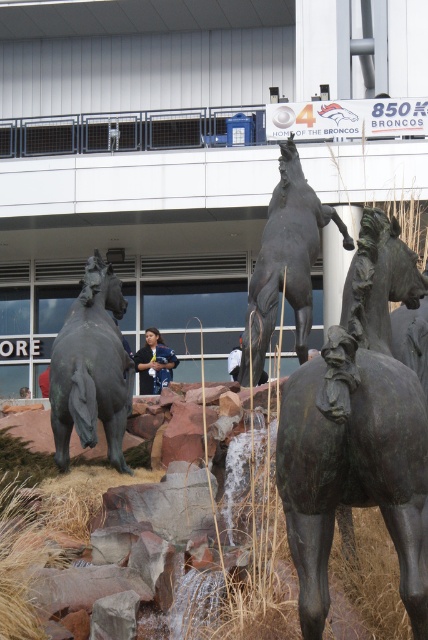
You are standing at the point with coordinates point (136, 360) and want to walk to the point with coordinates point (269, 307). Which direction should you move relative to the other point?

You should move forward towards point (269, 307) because it is in front of point (136, 360).

Looking at this image, you are a photographer trying to capture the two bronze horses in the scene. You notice the bronze textured horse at center and the bronze horse at upper center. Which horse is located to the right of the other?

The bronze textured horse at center is positioned on the right side of the bronze horse at upper center.

You are a photographer standing at the base of the sculpture. You want to take a photo that includes both the bronze horse at left and the matte blue shirt at center. Given that your camera has a maximum focus range of 8 meters, will you be able to capture both subjects in focus?

The bronze horse at left is 8.73 meters away from matte blue shirt at center. Since the camera can only focus up to 8 meters, the distance between them exceeds the focus range. Therefore, you won t be able to capture both subjects in focus simultaneously.